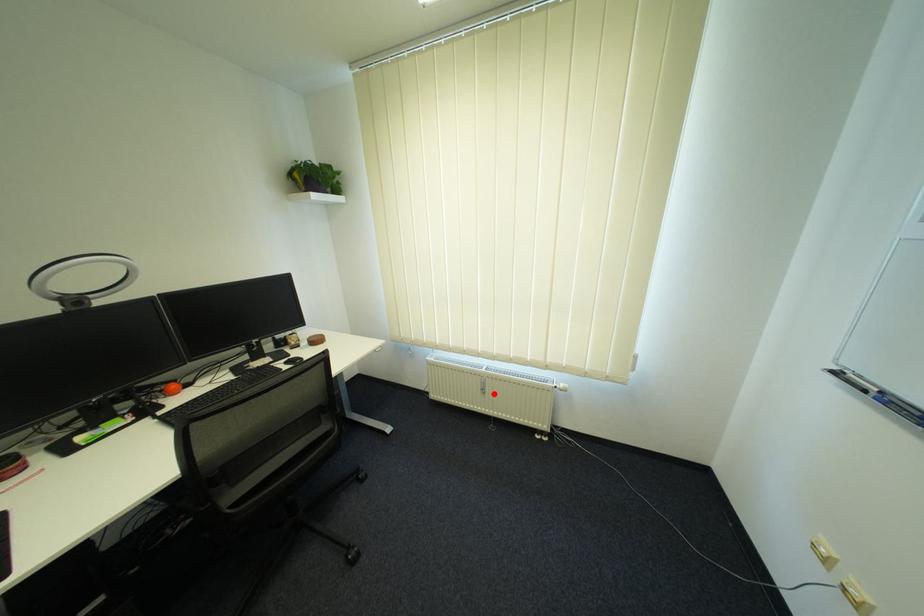
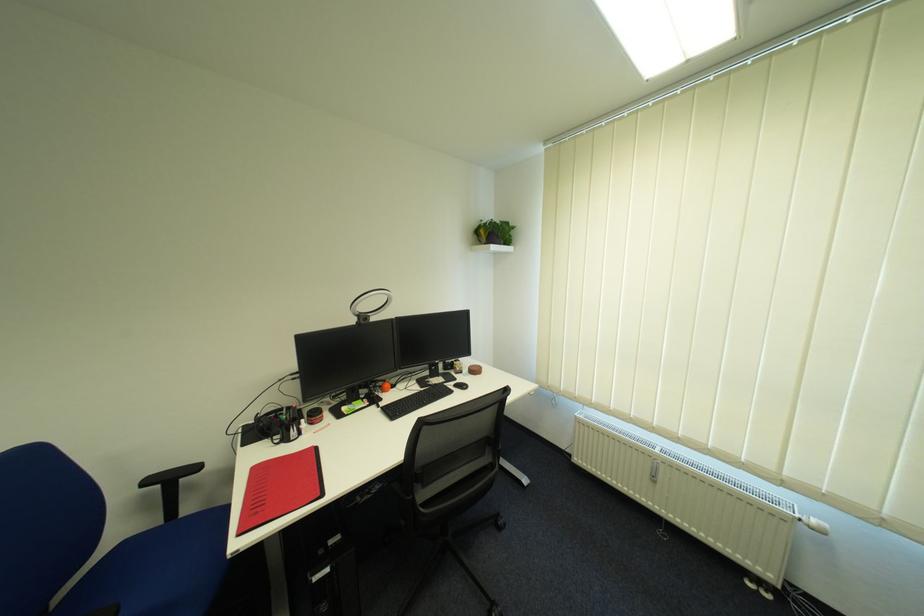
Locate, in the second image, the point that corresponds to the highlighted location in the first image.

(664, 483)